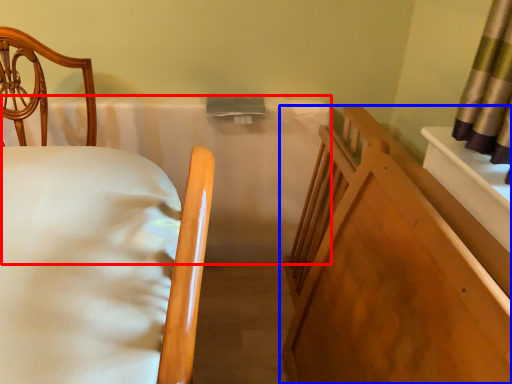
Question: Among these objects, which one is farthest to the camera, mattress (highlighted by a red box) or furniture (highlighted by a blue box)?

Choices:
 (A) mattress
 (B) furniture

Answer: (A)